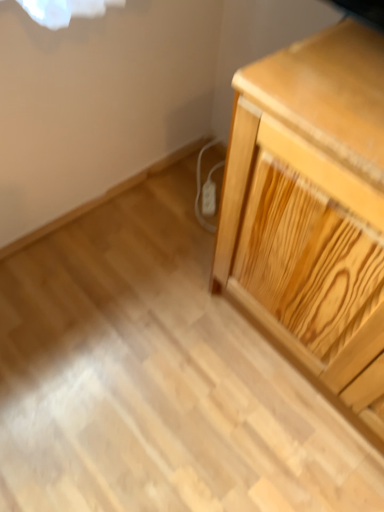
Where is `vacant area situated to the left side of light wood chest of drawers at right`? vacant area situated to the left side of light wood chest of drawers at right is located at coordinates (155, 329).